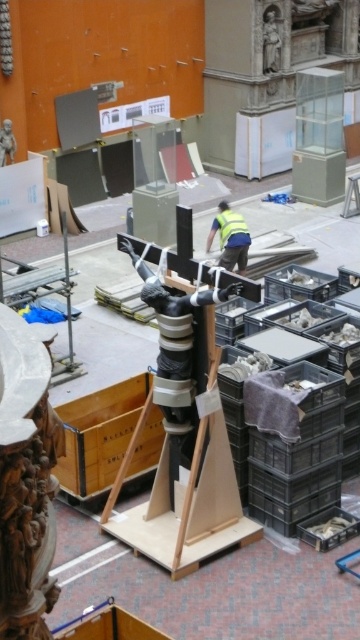
Who is more forward, [196,481] or [241,273]?

Positioned in front is point [196,481].

Is black matte crucifix at center positioned before yellow reflective vest at center?

Yes, black matte crucifix at center is in front of yellow reflective vest at center.

Describe the element at coordinates (176, 356) in the screenshot. I see `black matte crucifix at center` at that location.

The image size is (360, 640). In order to click on black matte crucifix at center in this screenshot , I will do `click(176, 356)`.